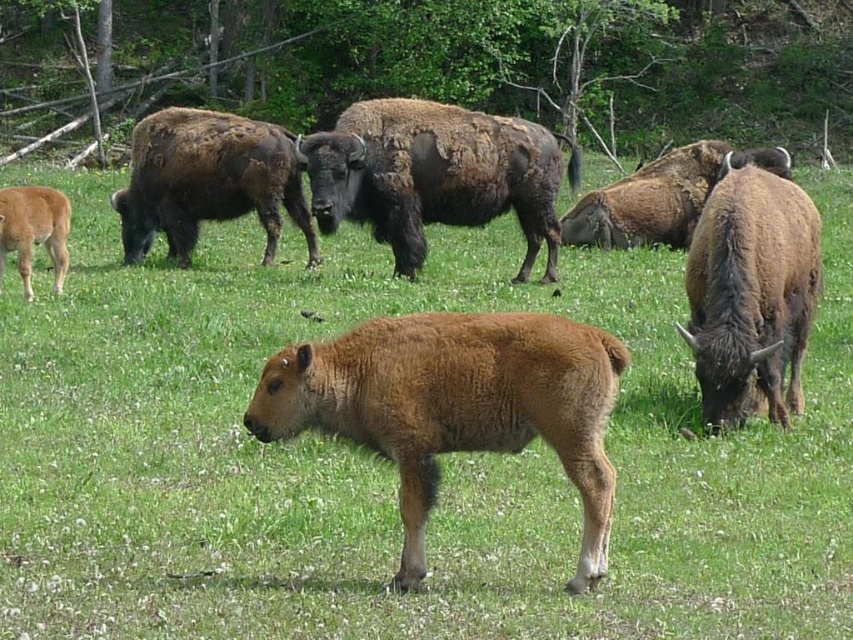
Is brown fuzzy bison at right closer to the viewer compared to light brown fur at lower left?

Yes, it is in front of light brown fur at lower left.

Can you confirm if brown fuzzy bison at right is positioned to the left of light brown fur at lower left?

Incorrect, brown fuzzy bison at right is not on the left side of light brown fur at lower left.

At what (x,y) coordinates should I click in order to perform the action: click on brown fuzzy bison at right. Please return your answer as a coordinate pair (x, y). The width and height of the screenshot is (853, 640). Looking at the image, I should click on (751, 294).

Find the location of `brown fuzzy bison at right`. brown fuzzy bison at right is located at coordinates pos(751,294).

Can you confirm if brown furry calf at center is positioned to the left of brown shaggy bison at center?

Indeed, brown furry calf at center is positioned on the left side of brown shaggy bison at center.

From the picture: Which of these two, brown furry calf at center or brown shaggy bison at center, stands taller?

brown shaggy bison at center is taller.

Is point (416, 513) behind point (549, 198)?

No, (416, 513) is closer to viewer.

Where is `brown furry calf at center`? brown furry calf at center is located at coordinates (456, 404).

Is point (756, 240) farther from camera compared to point (149, 161)?

No, (756, 240) is closer to viewer.

Does brown fuzzy bison at right lie in front of brown fuzzy bison at upper left?

Yes, it is in front of brown fuzzy bison at upper left.

At what (x,y) coordinates should I click in order to perform the action: click on brown fuzzy bison at right. Please return your answer as a coordinate pair (x, y). The image size is (853, 640). Looking at the image, I should click on (751, 294).